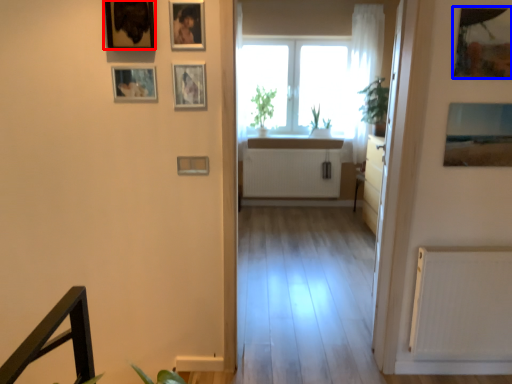
Question: Which point is further to the camera, picture frame (highlighted by a red box) or picture frame (highlighted by a blue box)?

Choices:
 (A) picture frame
 (B) picture frame

Answer: (B)